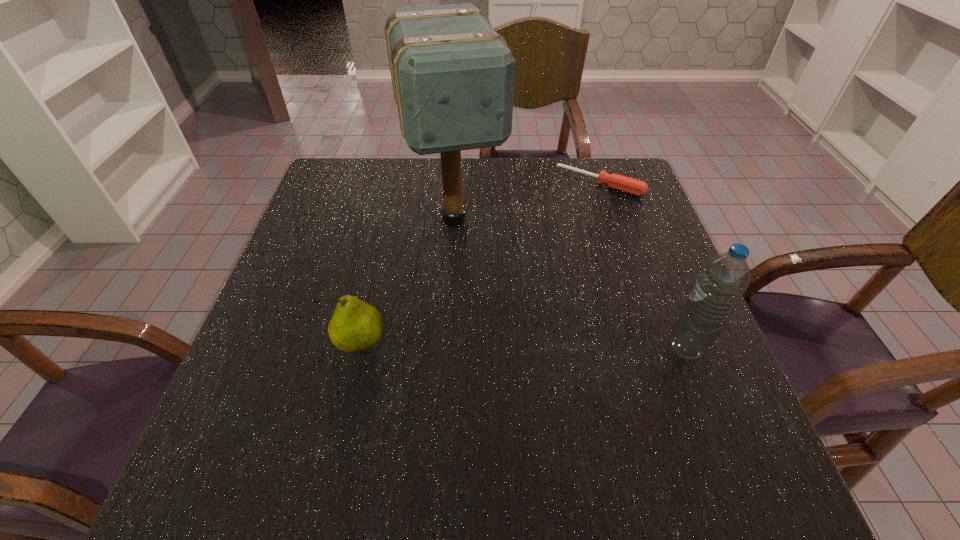
Where is `vacant space that is in between the pear and the second tallest object`? vacant space that is in between the pear and the second tallest object is located at coordinates pyautogui.click(x=522, y=347).

Image resolution: width=960 pixels, height=540 pixels. In order to click on vacant space in between the tallest object and the third tallest object in this screenshot , I will do `click(407, 282)`.

You are a GUI agent. You are given a task and a screenshot of the screen. Output one action in this format:
    pyautogui.click(x=<x>, y=<y>)
    Task: Click on the empty location between the second tallest object and the shortest object
    The image size is (960, 540).
    Given the screenshot: What is the action you would take?
    pyautogui.click(x=642, y=266)

Locate an element on the screen. The image size is (960, 540). object that ranks as the third closest to the shortest object is located at coordinates (356, 326).

Locate an element on the screen. The image size is (960, 540). object identified as the closest to the tallest object is located at coordinates (632, 186).

Find the location of a particular element. vacant space that satisfies the following two spatial constraints: 1. on the back side of the pear; 2. on the right side of the mallet is located at coordinates (389, 219).

Where is `vacant space that satisfies the following two spatial constraints: 1. on the back side of the pear; 2. on the right side of the screwdriver`? This screenshot has width=960, height=540. vacant space that satisfies the following two spatial constraints: 1. on the back side of the pear; 2. on the right side of the screwdriver is located at coordinates (397, 183).